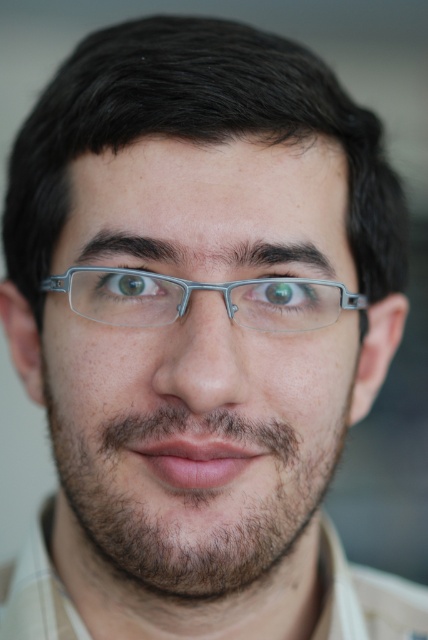
Question: Among these objects, which one is farthest from the camera?

Choices:
 (A) green matte eye at upper left
 (B) green matte eye at center
 (C) clear plastic glasses at center

Answer: (B)

Question: Where is clear plastic glasses at center located in relation to green matte eye at upper left in the image?

Choices:
 (A) right
 (B) left

Answer: (A)

Question: Is green matte eye at center below green matte eye at upper left?

Choices:
 (A) no
 (B) yes

Answer: (B)

Question: Which of these objects is positioned closest to the clear plastic glasses at center?

Choices:
 (A) green matte eye at center
 (B) green matte eye at upper left

Answer: (A)

Question: Does clear plastic glasses at center have a greater width compared to green matte eye at upper left?

Choices:
 (A) no
 (B) yes

Answer: (B)

Question: Which object appears closest to the camera in this image?

Choices:
 (A) green matte eye at upper left
 (B) green matte eye at center

Answer: (A)